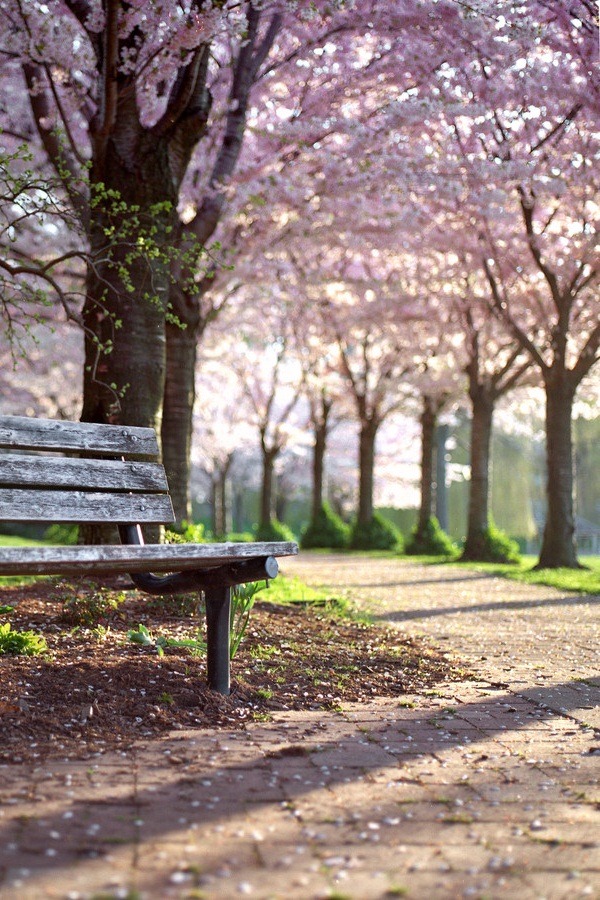
Identify the location of bench. This screenshot has height=900, width=600. (122, 508).